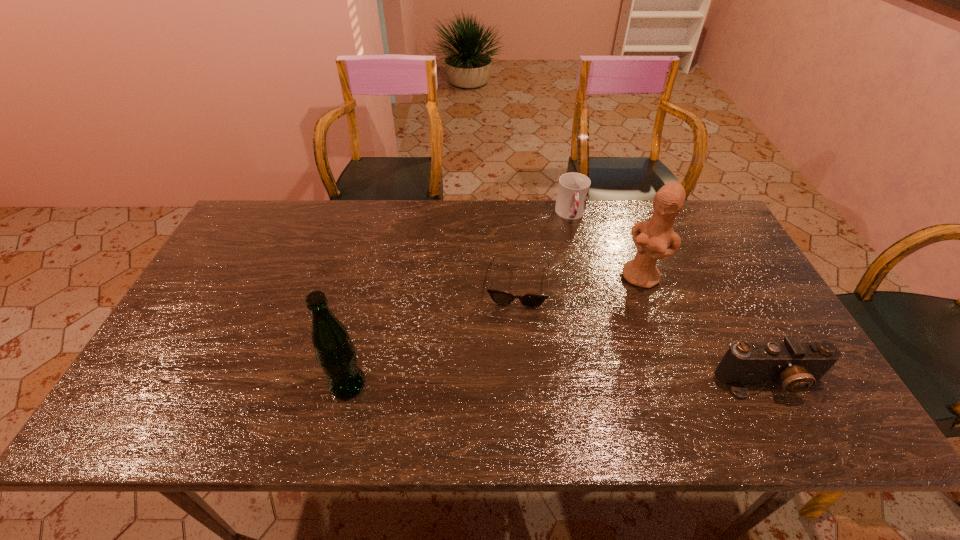
Locate an element on the screen. The image size is (960, 540). beer bottle is located at coordinates (335, 352).

The height and width of the screenshot is (540, 960). Identify the location of the rightmost object. (798, 366).

Where is `the second object from right to left`? the second object from right to left is located at coordinates (651, 238).

The width and height of the screenshot is (960, 540). I want to click on the farthest object, so click(x=573, y=188).

At what (x,y) coordinates should I click in order to perform the action: click on cup. Please return your answer as a coordinate pair (x, y). Looking at the image, I should click on (573, 188).

The width and height of the screenshot is (960, 540). Identify the location of the shortest object. (500, 297).

Locate an element on the screen. The height and width of the screenshot is (540, 960). sunglasses is located at coordinates (500, 297).

Find the location of a particular element. free space located 0.160m on the back of the leftmost object is located at coordinates (364, 318).

Identify the location of free space located 0.400m on the front-facing side of the figurine. (568, 393).

Locate an element on the screen. The height and width of the screenshot is (540, 960). vacant space located 0.090m on the front-facing side of the figurine is located at coordinates (621, 309).